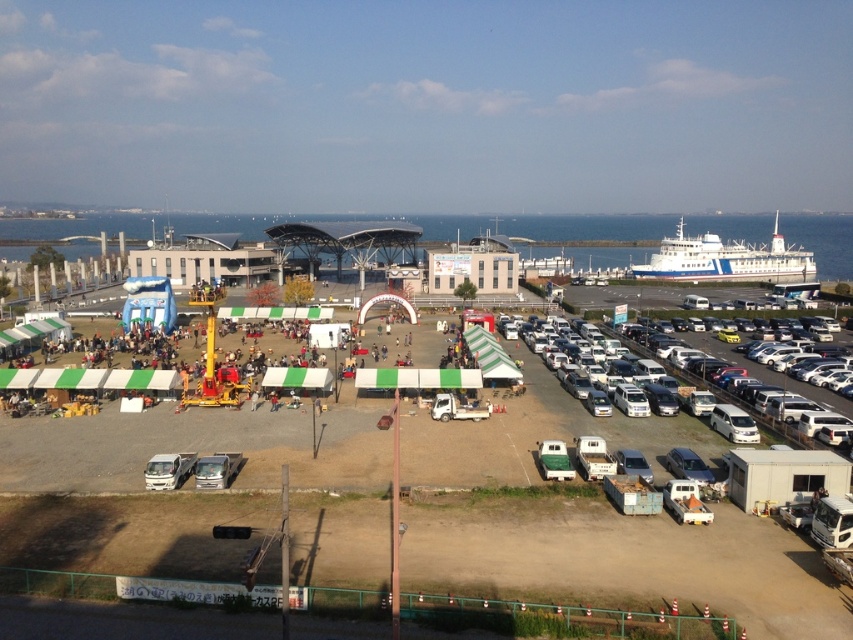
Consider the image. How distant is white matte truck at lower right from white matte truck at center?

A distance of 30.14 meters exists between white matte truck at lower right and white matte truck at center.

Which is in front, point (830, 513) or point (434, 410)?

Point (830, 513) is more forward.

Locate an element on the screen. The height and width of the screenshot is (640, 853). white matte truck at lower right is located at coordinates (833, 522).

Consider the image. Is white matte truck at lower right taller than white matte truck at lower left?

Indeed, white matte truck at lower right has a greater height compared to white matte truck at lower left.

This screenshot has height=640, width=853. What do you see at coordinates (833, 522) in the screenshot?
I see `white matte truck at lower right` at bounding box center [833, 522].

Is point (831, 545) more distant than point (180, 476)?

That is False.

Where is `white matte truck at lower right`? The image size is (853, 640). white matte truck at lower right is located at coordinates (833, 522).

Is blue polished ship at right positioned at the back of white matte minivan at right?

Yes, it is behind white matte minivan at right.

Does point (717, 241) lie behind point (750, 429)?

That is True.

I want to click on blue polished ship at right, so click(726, 259).